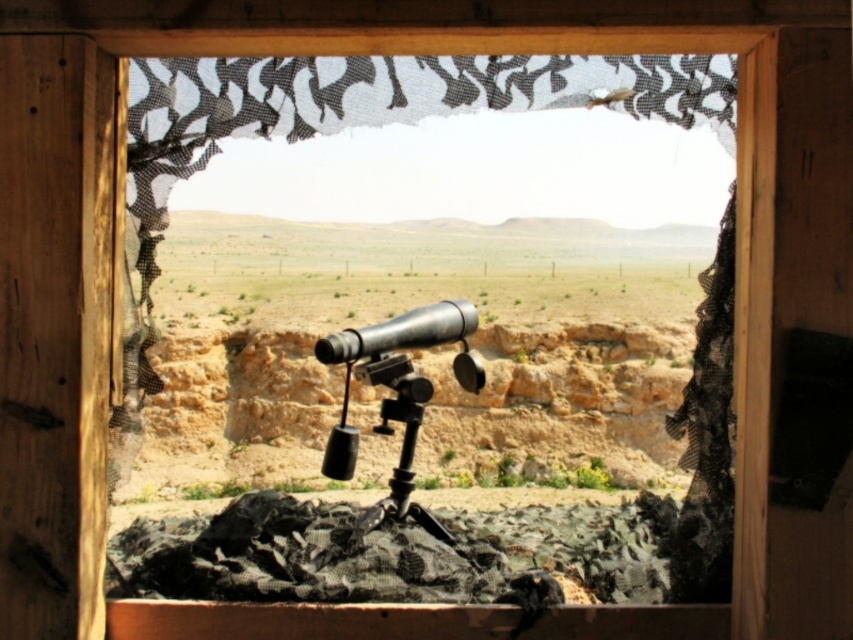
Question: Is black mesh curtain at right smaller than brushed metal telescope at center?

Choices:
 (A) yes
 (B) no

Answer: (B)

Question: Which point appears closest to the camera in this image?

Choices:
 (A) (682, 419)
 (B) (461, 324)

Answer: (A)

Question: Is black mesh curtain at right thinner than brushed metal telescope at center?

Choices:
 (A) yes
 (B) no

Answer: (B)

Question: Which object appears farthest from the camera in this image?

Choices:
 (A) black mesh curtain at right
 (B) brushed metal telescope at center

Answer: (B)

Question: Is black mesh curtain at right to the right of brushed metal telescope at center from the viewer's perspective?

Choices:
 (A) no
 (B) yes

Answer: (B)

Question: Which of the following is the closest to the observer?

Choices:
 (A) black mesh curtain at right
 (B) brushed metal telescope at center

Answer: (A)